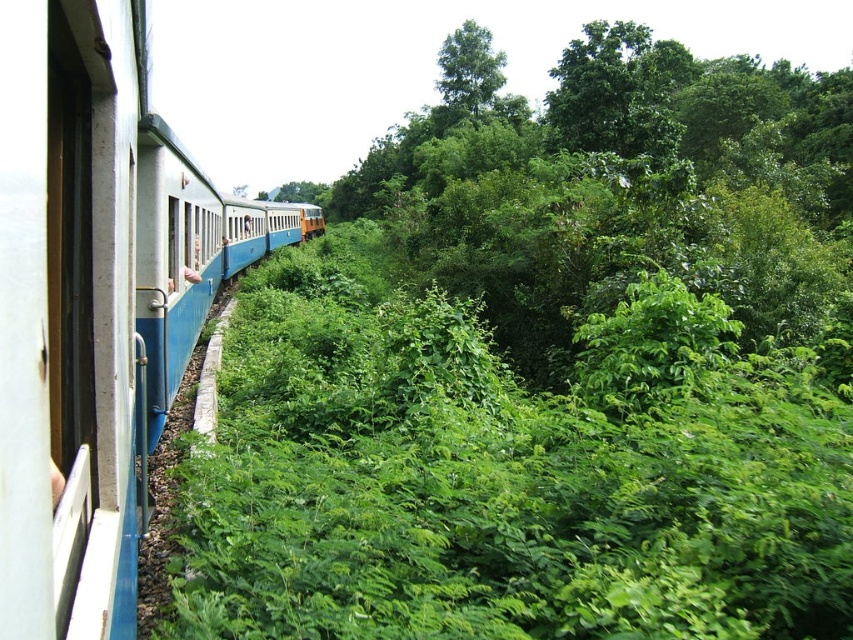
You are a passenger sitting in the blue painted metal train at left and want to see the green leafy tree at center outside. Is the tree visible from your current position inside the train?

The green leafy tree at center is above the blue painted metal train at left, so yes, the tree is visible from inside the train as it is positioned above the train.

Looking at this image, you are sitting in the train car and looking out the window. You see two points marked on the window. The first point is at coordinate point(57, 371) and the second point is at point(492, 68). Which point is closer to you?

Point(57, 371) is in front of point(492, 68), so it is closer to you.

You are a passenger sitting inside the train and looking out the window. You notice two green leafy trees outside. Which tree, the green leafy tree at center or the green leafy tree at upper center, is closer to the train?

The green leafy tree at center is closer to the train because it is located below the green leafy tree at upper center, indicating it is positioned in front in the visual plane.